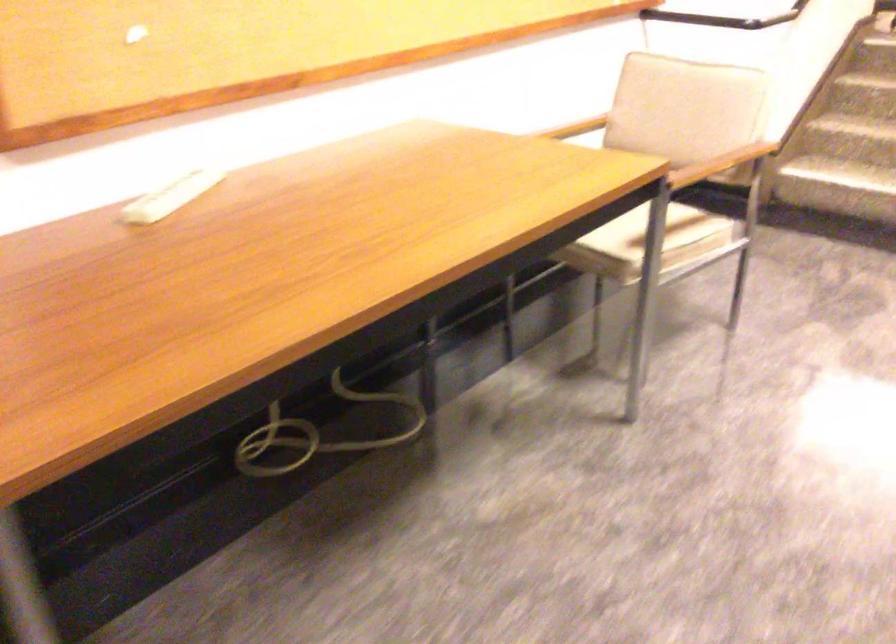
Find where to press the white remote control. Please return your answer as a coordinate pair (x, y).

(170, 196)